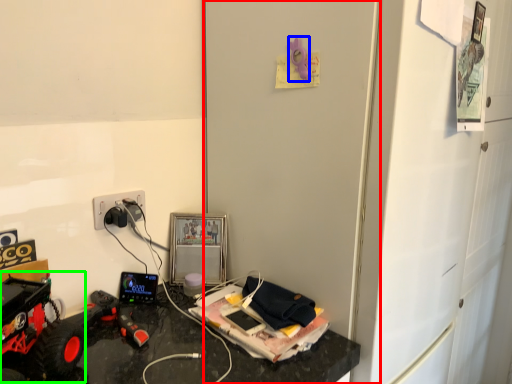
Question: Considering the real-world distances, which object is closest to door (highlighted by a red box)? toy (highlighted by a blue box) or toy car (highlighted by a green box).

Choices:
 (A) toy
 (B) toy car

Answer: (A)